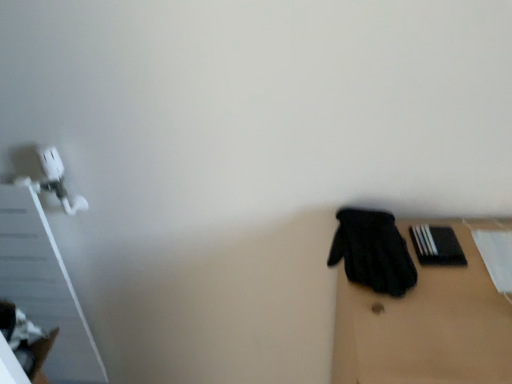
Question: Can you confirm if black fabric glove at right is thinner than black matte book at right?

Choices:
 (A) yes
 (B) no

Answer: (B)

Question: From a real-world perspective, is black fabric glove at right below black matte book at right?

Choices:
 (A) yes
 (B) no

Answer: (B)

Question: Is the depth of black fabric glove at right less than that of black matte book at right?

Choices:
 (A) no
 (B) yes

Answer: (B)

Question: Is black fabric glove at right to the right of black matte book at right from the viewer's perspective?

Choices:
 (A) yes
 (B) no

Answer: (B)

Question: From the image's perspective, would you say black fabric glove at right is shown under black matte book at right?

Choices:
 (A) yes
 (B) no

Answer: (A)

Question: Is black fabric glove at right directly adjacent to black matte book at right?

Choices:
 (A) yes
 (B) no

Answer: (A)

Question: Is black matte book at right at the left side of black matte gloves at right?

Choices:
 (A) yes
 (B) no

Answer: (A)

Question: Is black matte book at right next to black matte gloves at right and touching it?

Choices:
 (A) no
 (B) yes

Answer: (A)

Question: Can you confirm if black matte book at right is shorter than black matte gloves at right?

Choices:
 (A) yes
 (B) no

Answer: (A)

Question: From a real-world perspective, is black matte book at right located beneath black matte gloves at right?

Choices:
 (A) yes
 (B) no

Answer: (B)

Question: Is black matte book at right thinner than black matte gloves at right?

Choices:
 (A) no
 (B) yes

Answer: (B)

Question: Is black matte book at right not inside black matte gloves at right?

Choices:
 (A) yes
 (B) no

Answer: (A)

Question: Can black matte book at right be found inside black matte gloves at right?

Choices:
 (A) no
 (B) yes

Answer: (A)